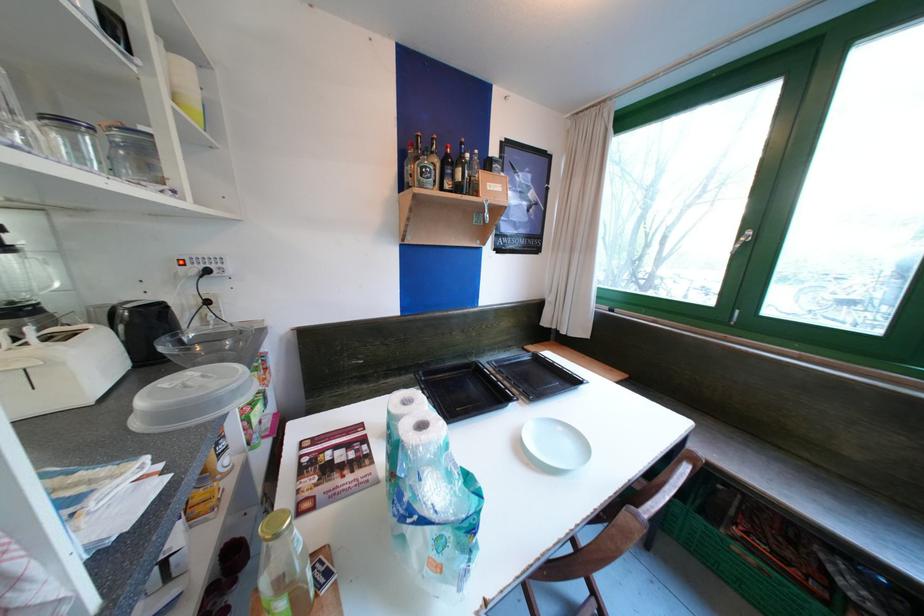
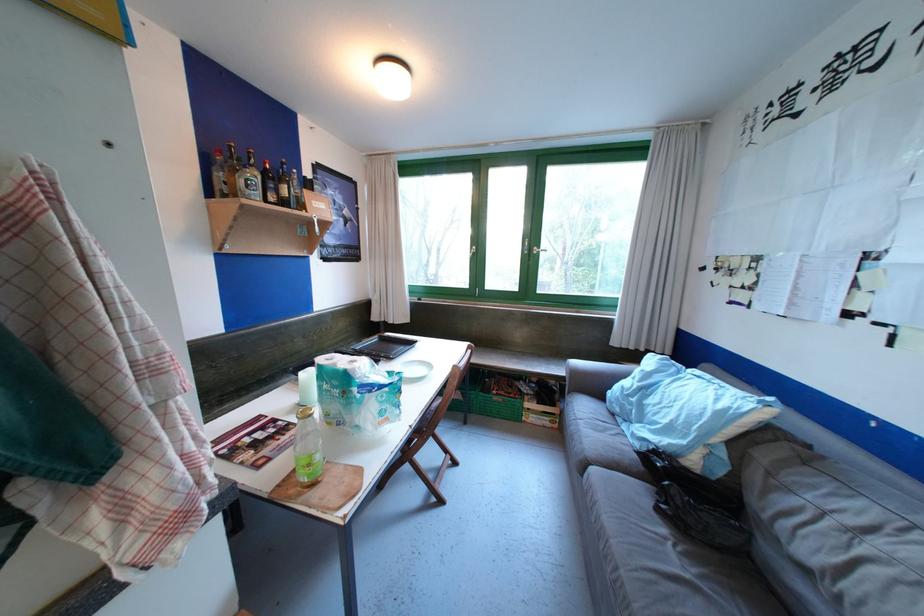
The point at [430,428] is marked in the first image. Where is the corresponding point in the second image?

(359, 363)